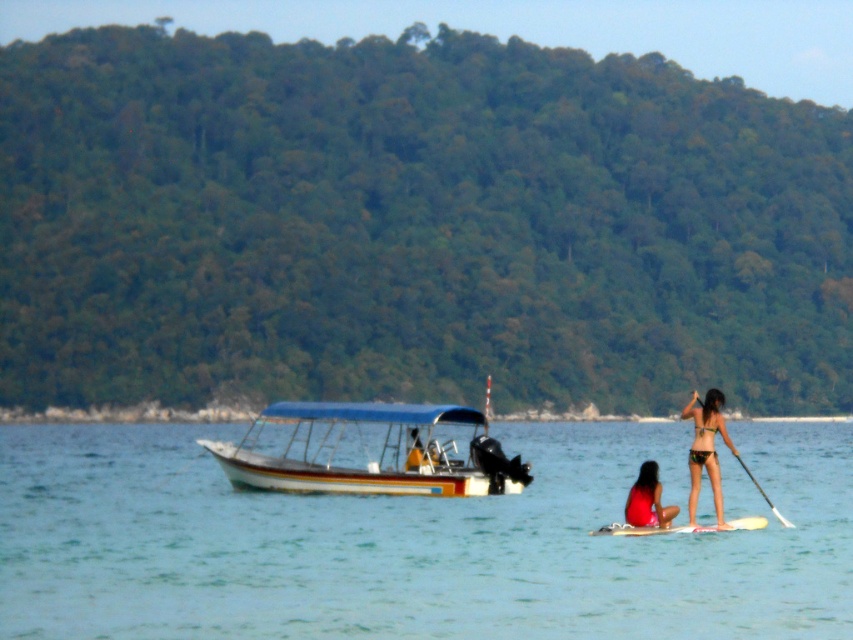
Question: Is clear blue water at center below matte red swimsuit at lower center?

Choices:
 (A) yes
 (B) no

Answer: (A)

Question: Among these objects, which one is nearest to the camera?

Choices:
 (A) white foam surfboard at lower center
 (B) white plastic paddle at center
 (C) white glossy paddle at right
 (D) matte black bikini at center

Answer: (C)

Question: Does white foam surfboard at lower center lie in front of white plastic paddle at center?

Choices:
 (A) yes
 (B) no

Answer: (B)

Question: Which point is closer to the camera taking this photo?

Choices:
 (A) (755, 481)
 (B) (270, 422)
 (C) (643, 492)
 (D) (670, 529)

Answer: (C)

Question: Does clear blue water at center appear on the right side of wooden boat at center?

Choices:
 (A) no
 (B) yes

Answer: (B)

Question: Considering the real-world distances, which object is closest to the white glossy paddle at right?

Choices:
 (A) white foam surfboard at lower center
 (B) matte red swimsuit at lower center
 (C) wooden boat at center

Answer: (A)